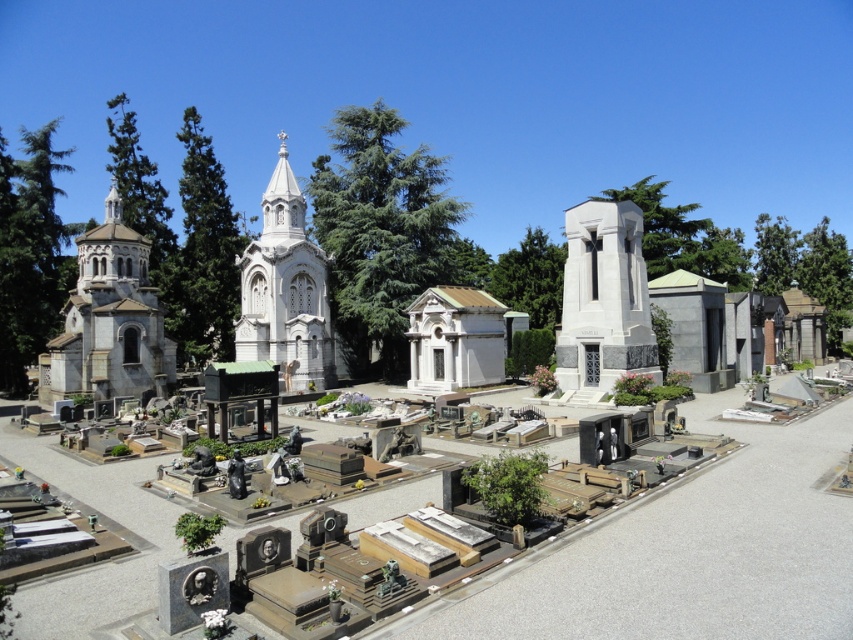
You are standing in the cemetery and want to visit both the white marble church at left and the white marble church at center. Which one should you approach first to be closer to your starting position?

You should approach the white marble church at left first because it is closer to you than the white marble church at center.

You are standing in the cemetery and see the white marble monument at center and the white marble church at center. Which one is positioned to the right side?

The white marble monument at center is positioned to the right of the white marble church at center.

You are planning to place a new flower arrangement between the white marble church at left and the white marble monument at center. Considering their widths, which object will require more space to the side for the arrangement?

The white marble church at left has a greater width than the white marble monument at center, so placing the flower arrangement between them would require more space to the side of the white marble church at left.